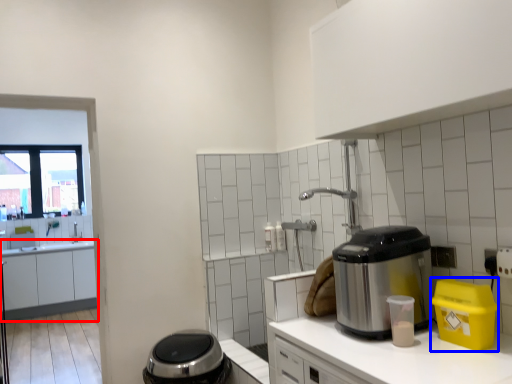
Question: Which object is closer to the camera taking this photo, cabinetry (highlighted by a red box) or appliance (highlighted by a blue box)?

Choices:
 (A) cabinetry
 (B) appliance

Answer: (B)